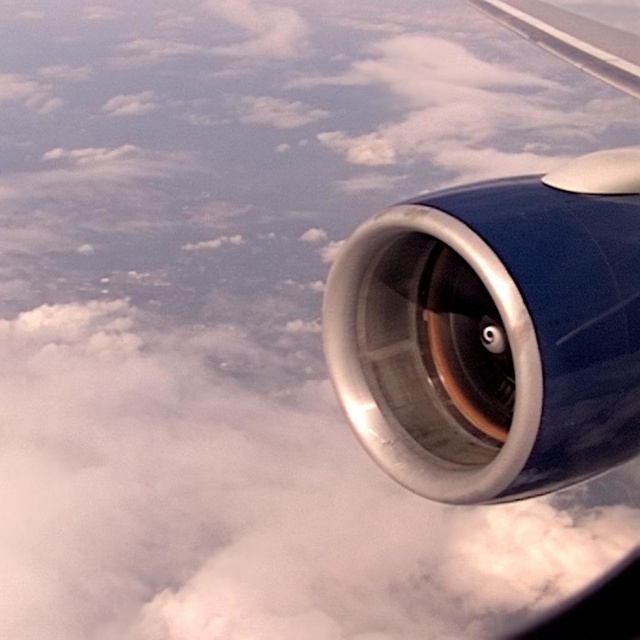
You are a pilot checking the engine status during flight. You notice the blue metallic engine at right and the metallic silver wing at upper right. Which object is closer to you, the pilot, in this view?

The blue metallic engine at right is closer to you because it is positioned in front of the metallic silver wing at upper right.

You are a flight engineer assessing the engine and wing components of an aircraft. Given the blue metallic engine at right and the metallic silver wing at upper right, which component has a greater width?

The metallic silver wing at upper right has a greater width than the blue metallic engine at right.

You are a pilot checking the engine status from the cockpit. You notice the blue metallic engine at right and the metallic silver wing at upper right. Which object is positioned lower in the image?

The blue metallic engine at right is positioned below the metallic silver wing at upper right, so it is lower in the image.